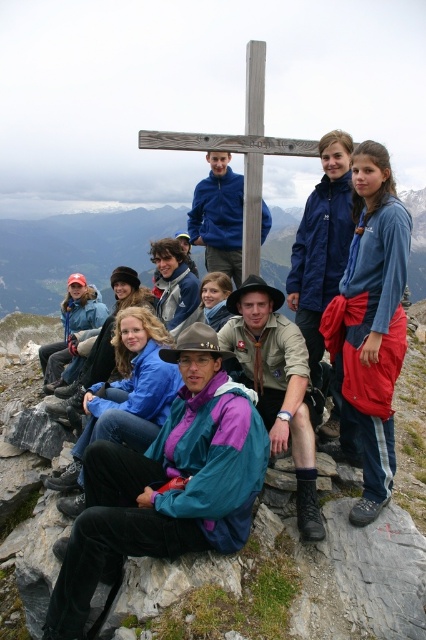
Question: Can you confirm if teal nylon jacket at center is smaller than wooden cross at center?

Choices:
 (A) yes
 (B) no

Answer: (A)

Question: Is teal nylon jacket at center to the right of blue fleece jacket at upper right from the viewer's perspective?

Choices:
 (A) no
 (B) yes

Answer: (A)

Question: Which point appears farthest from the camera in this image?

Choices:
 (A) (247, 403)
 (B) (351, 173)

Answer: (B)

Question: Estimate the real-world distances between objects in this image. Which object is closer to the teal nylon jacket at center?

Choices:
 (A) blue fleece jacket at upper right
 (B) wooden cross at center

Answer: (A)

Question: Which object is positioned closest to the blue fleece jacket at upper right?

Choices:
 (A) teal nylon jacket at center
 (B) wooden cross at center

Answer: (B)

Question: Is blue fleece jacket at upper right further to the viewer compared to wooden cross at center?

Choices:
 (A) yes
 (B) no

Answer: (B)